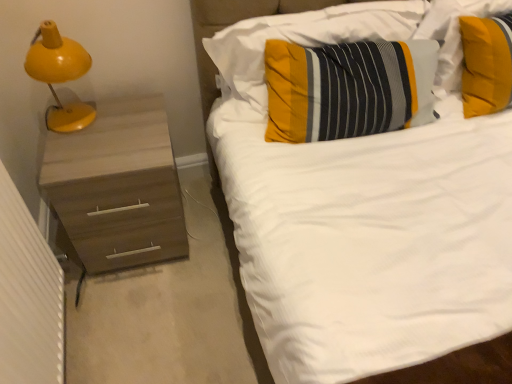
Question: Is striped fabric pillow at upper right, arranged as the first pillow when viewed from the right, further to the viewer compared to striped fabric pillow at center, the first pillow in the left-to-right sequence?

Choices:
 (A) no
 (B) yes

Answer: (B)

Question: Is striped fabric pillow at upper right, which ranks as the 3th pillow in left-to-right order, to the left of striped fabric pillow at center, the first pillow in the left-to-right sequence, from the viewer's perspective?

Choices:
 (A) yes
 (B) no

Answer: (B)

Question: Considering the relative sizes of striped fabric pillow at upper right, arranged as the first pillow when viewed from the right, and striped fabric pillow at center, the third pillow viewed from the right, in the image provided, is striped fabric pillow at upper right, arranged as the first pillow when viewed from the right, bigger than striped fabric pillow at center, the third pillow viewed from the right,?

Choices:
 (A) no
 (B) yes

Answer: (A)

Question: Can you confirm if striped fabric pillow at upper right, arranged as the first pillow when viewed from the right, is smaller than striped fabric pillow at center, the third pillow viewed from the right?

Choices:
 (A) no
 (B) yes

Answer: (B)

Question: Is striped fabric pillow at upper right, which ranks as the 3th pillow in left-to-right order, directly adjacent to striped fabric pillow at center, the first pillow in the left-to-right sequence?

Choices:
 (A) no
 (B) yes

Answer: (A)

Question: From a real-world perspective, is yellow matte lamp at left above or below textured yellow pillow at center, which is the second pillow in left-to-right order?

Choices:
 (A) below
 (B) above

Answer: (B)

Question: Which is correct: yellow matte lamp at left is inside textured yellow pillow at center, the 2th pillow when ordered from right to left, or outside of it?

Choices:
 (A) outside
 (B) inside

Answer: (A)

Question: Visually, is yellow matte lamp at left positioned to the left or to the right of textured yellow pillow at center, the 2th pillow when ordered from right to left?

Choices:
 (A) left
 (B) right

Answer: (A)

Question: Is yellow matte lamp at left taller or shorter than textured yellow pillow at center, which is the second pillow in left-to-right order?

Choices:
 (A) tall
 (B) short

Answer: (A)

Question: In terms of width, does striped fabric pillow at center, the third pillow viewed from the right, look wider or thinner when compared to textured yellow pillow at center, which is the second pillow in left-to-right order?

Choices:
 (A) wide
 (B) thin

Answer: (B)

Question: In the image, is striped fabric pillow at center, the first pillow in the left-to-right sequence, on the left side or the right side of textured yellow pillow at center, which is the second pillow in left-to-right order?

Choices:
 (A) left
 (B) right

Answer: (A)

Question: From a real-world perspective, relative to textured yellow pillow at center, the 2th pillow when ordered from right to left, is striped fabric pillow at center, the first pillow in the left-to-right sequence, vertically above or below?

Choices:
 (A) below
 (B) above

Answer: (B)

Question: Is point (297, 28) positioned closer to the camera than point (399, 94)?

Choices:
 (A) farther
 (B) closer

Answer: (A)

Question: In terms of width, does striped fabric pillow at upper right, arranged as the first pillow when viewed from the right, look wider or thinner when compared to textured yellow pillow at center, the 2th pillow when ordered from right to left?

Choices:
 (A) wide
 (B) thin

Answer: (B)

Question: Does point coord(429,29) appear closer or farther from the camera than point coord(394,69)?

Choices:
 (A) farther
 (B) closer

Answer: (A)